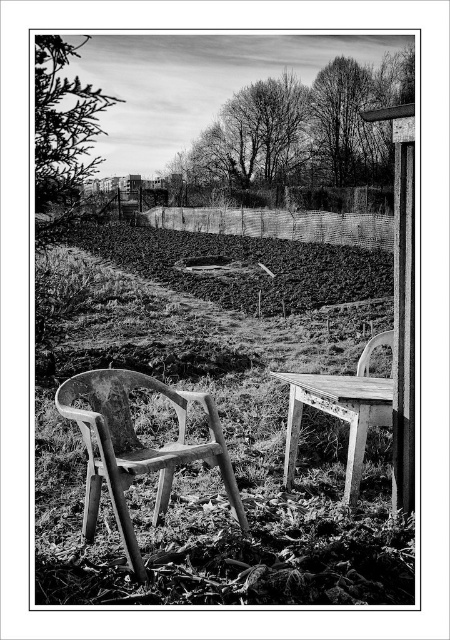
Question: Does wooden chair at center come behind wooden chair at right?

Choices:
 (A) yes
 (B) no

Answer: (B)

Question: Which point is farther to the camera?

Choices:
 (A) wooden chair at center
 (B) green leafy tree at upper left
 (C) green grass at center
 (D) bare branches at upper center

Answer: (B)

Question: Observing the image, what is the correct spatial positioning of green grass at center in reference to wooden chair at center?

Choices:
 (A) below
 (B) above

Answer: (B)

Question: Estimate the real-world distances between objects in this image. Which object is farther from the wooden chair at right?

Choices:
 (A) green leafy tree at upper left
 (B) wooden chair at center
 (C) green grass at center
 (D) bare branches at upper center

Answer: (D)

Question: Can you confirm if green grass at center is smaller than wooden chair at right?

Choices:
 (A) yes
 (B) no

Answer: (B)

Question: Considering the real-world distances, which object is closest to the wooden chair at right?

Choices:
 (A) green grass at center
 (B) wooden chair at center

Answer: (B)